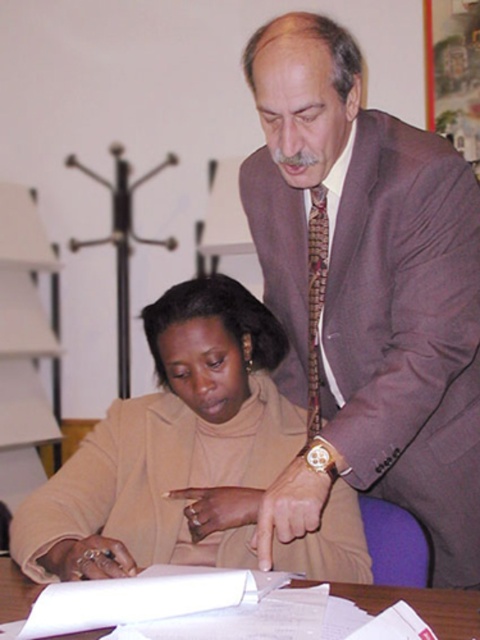
You are organizing a meeting and need to place a 12 inch wide folder on the table. The beige fabric jacket at lower left and the white paper at center are already on the table. Which object has enough width to accommodate the folder without overlapping?

The beige fabric jacket at lower left has a width that surpasses the white paper at center, so the beige fabric jacket at lower left can accommodate the 12 inch wide folder without overlapping.

You are organizing a small meeting in an office and need to place a name tag on the table. The name tag is the same size as the white paper at center. Will the beige fabric jacket at lower left on the table block the name tag from being fully visible?

The beige fabric jacket at lower left is larger in size than the white paper at center. Since the name tag is the same size as the white paper at center, the jacket may block part of the name tag depending on their positions.